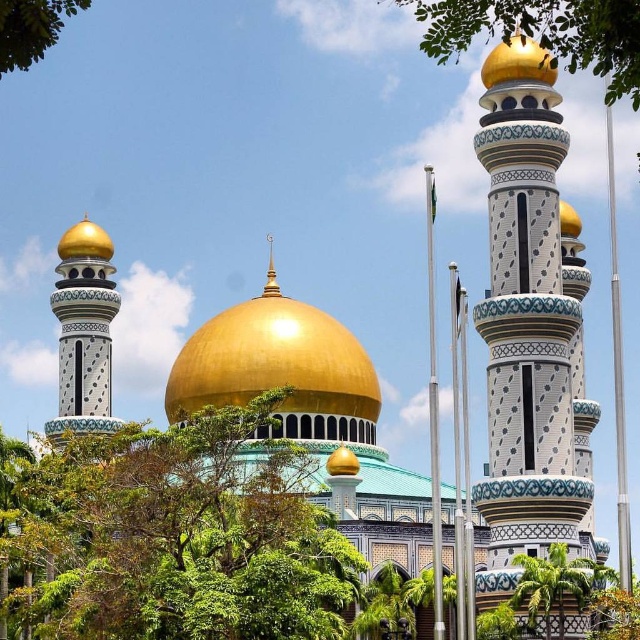
Looking at the grand mosque with its golden domes and minarets, you notice a green leafy tree at center and a gold shiny dome at center. Which object occupies more horizontal space in the image?

The green leafy tree at center has a larger width than the gold shiny dome at center, so it occupies more horizontal space in the image.

You are standing in front of the mosque and want to take a photo of both the green leafy tree at center and the gold shiny dome at center. Which object will appear larger in the photo?

The green leafy tree at center will appear larger in the photo because it is closer to the viewer than the gold shiny dome at center.